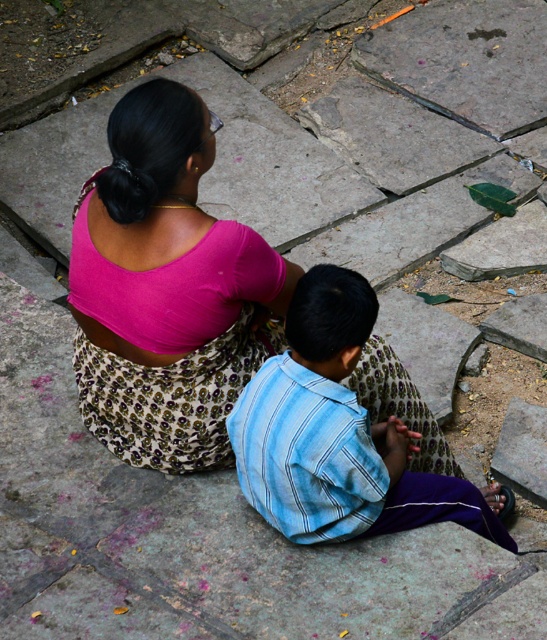
Question: Is pink fabric at center below blue striped shirt at center?

Choices:
 (A) no
 (B) yes

Answer: (A)

Question: Can you confirm if pink fabric at center is smaller than blue striped shirt at center?

Choices:
 (A) no
 (B) yes

Answer: (B)

Question: Is pink fabric at center above blue striped shirt at center?

Choices:
 (A) no
 (B) yes

Answer: (B)

Question: Which of the following is the farthest from the observer?

Choices:
 (A) pink fabric at center
 (B) blue striped shirt at center

Answer: (B)